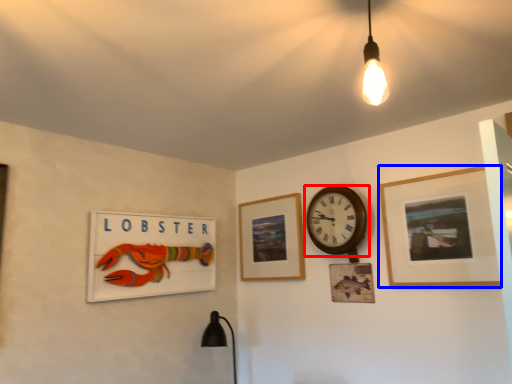
Question: Among these objects, which one is nearest to the camera, wall clock (highlighted by a red box) or picture frame (highlighted by a blue box)?

Choices:
 (A) wall clock
 (B) picture frame

Answer: (B)